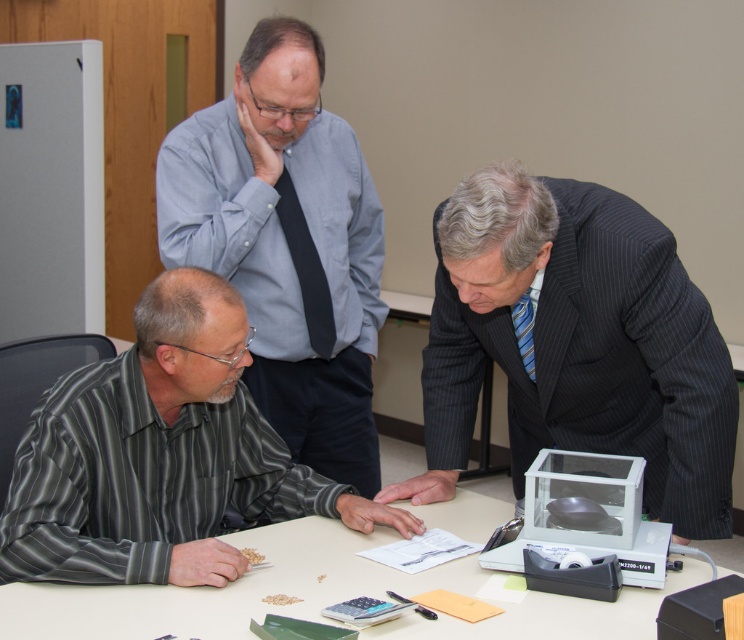
Question: Can you confirm if gray striped shirt at lower left is positioned to the left of light blue shirt at upper center?

Choices:
 (A) no
 (B) yes

Answer: (B)

Question: Which object is farther from the camera taking this photo?

Choices:
 (A) white plastic table at center
 (B) blue striped tie at right

Answer: (B)

Question: Which object is closer to the camera taking this photo?

Choices:
 (A) black silk tie at center
 (B) dark gray pinstripe suit at center
 (C) light blue shirt at upper center
 (D) gray striped shirt at lower left

Answer: (D)

Question: Is gray striped shirt at lower left closer to camera compared to black silk tie at center?

Choices:
 (A) no
 (B) yes

Answer: (B)

Question: Which object is the farthest from the black silk tie at center?

Choices:
 (A) gray striped shirt at lower left
 (B) light blue shirt at upper center
 (C) white plastic table at center
 (D) dark gray pinstripe suit at center

Answer: (C)

Question: Does black silk tie at center lie in front of blue striped tie at right?

Choices:
 (A) yes
 (B) no

Answer: (B)